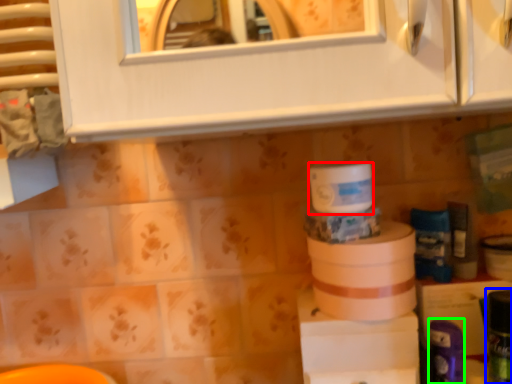
Question: Which is farther away from toilet paper (highlighted by a red box)? toiletry (highlighted by a blue box) or toiletry (highlighted by a green box)?

Choices:
 (A) toiletry
 (B) toiletry

Answer: (A)